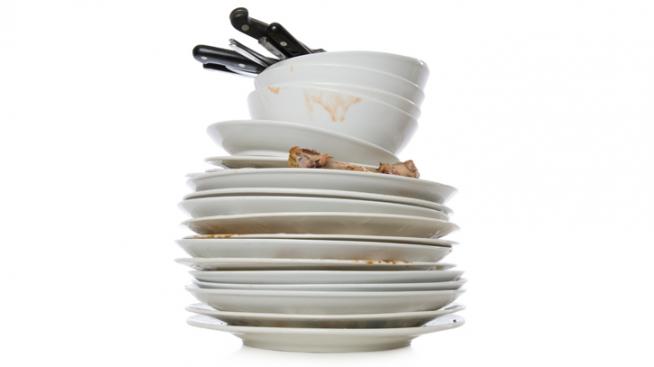
This screenshot has height=367, width=654. In order to click on utensils in this screenshot , I will do `click(276, 35)`, `click(247, 23)`, `click(269, 48)`, `click(250, 51)`, `click(229, 59)`, `click(233, 73)`.